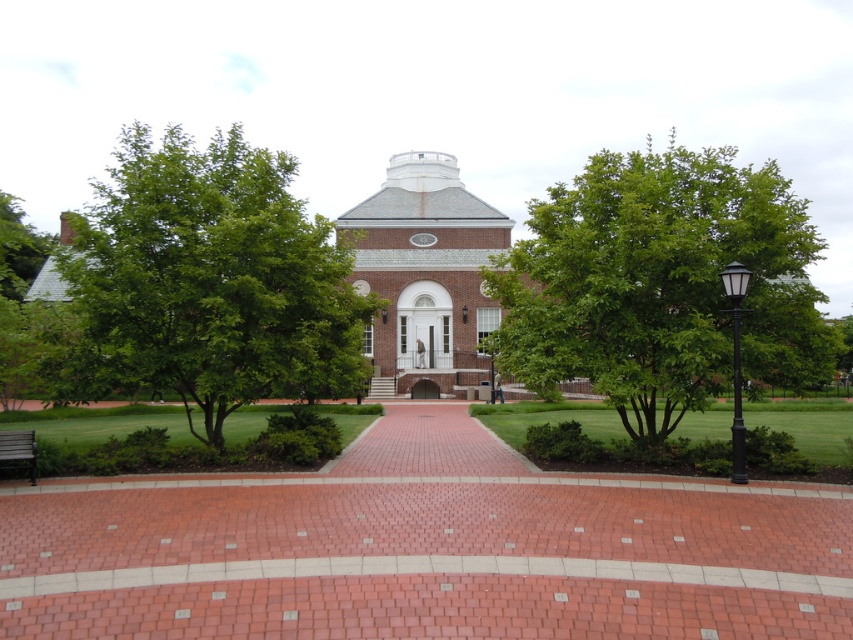
Question: From the image, what is the correct spatial relationship of green leafy tree at center in relation to green leafy tree at left?

Choices:
 (A) above
 (B) below

Answer: (B)

Question: Which of the following is the farthest from the observer?

Choices:
 (A) (694, 296)
 (B) (281, 324)

Answer: (B)

Question: Which of the following is the closest to the observer?

Choices:
 (A) brick at center
 (B) green leafy tree at center

Answer: (A)

Question: Which point is closer to the camera?

Choices:
 (A) (428, 572)
 (B) (148, 272)
 (C) (410, 209)
 (D) (566, 308)

Answer: (A)

Question: Is brick building at center thinner than wooden park bench at lower left?

Choices:
 (A) yes
 (B) no

Answer: (B)

Question: Is green leafy tree at center smaller than wooden park bench at lower left?

Choices:
 (A) yes
 (B) no

Answer: (B)